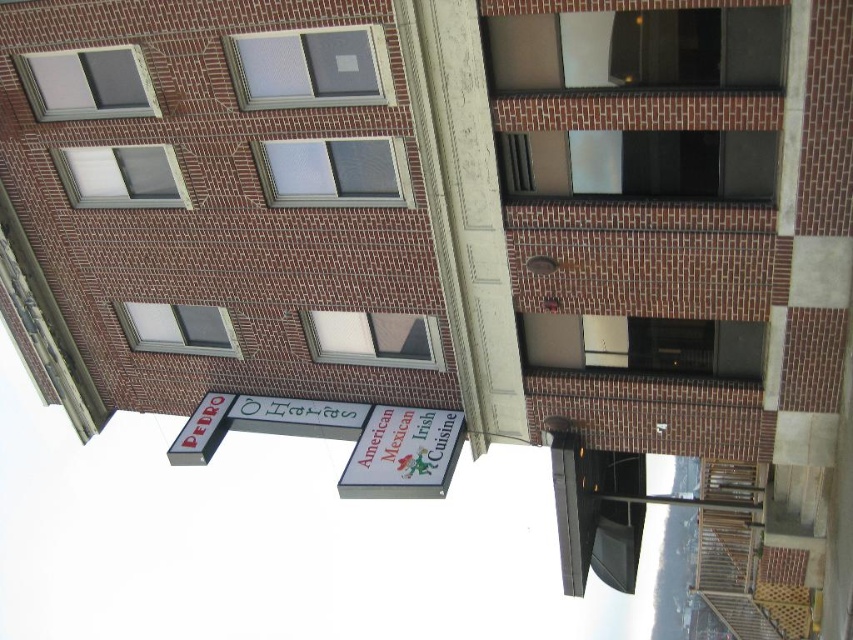
Does white plastic sign at lower center have a greater width compared to metallic silver sign at left?

→ Yes.

Can you confirm if white plastic sign at lower center is thinner than metallic silver sign at left?

No, white plastic sign at lower center is not thinner than metallic silver sign at left.

Does point (378, 483) lie in front of point (222, 396)?

Yes, point (378, 483) is in front of point (222, 396).

Identify the location of white plastic sign at lower center. Image resolution: width=853 pixels, height=640 pixels. (403, 452).